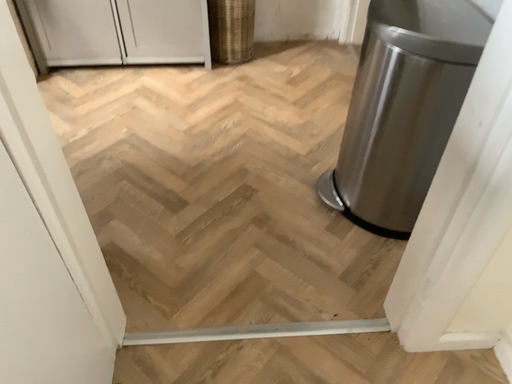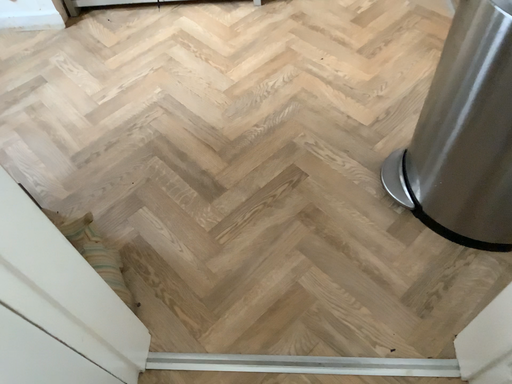
Question: Which way did the camera rotate in the video?

Choices:
 (A) rotated downward
 (B) rotated upward

Answer: (A)